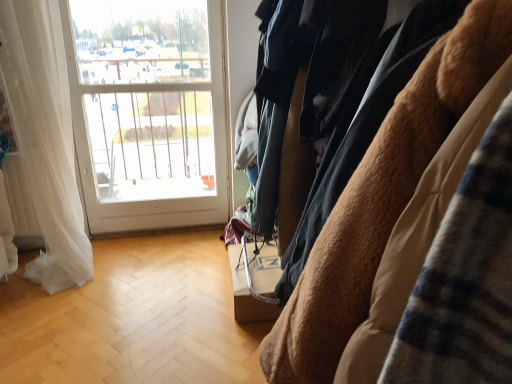
Identify the location of free location in front of white glass window at upper left. Image resolution: width=512 pixels, height=384 pixels. (153, 262).